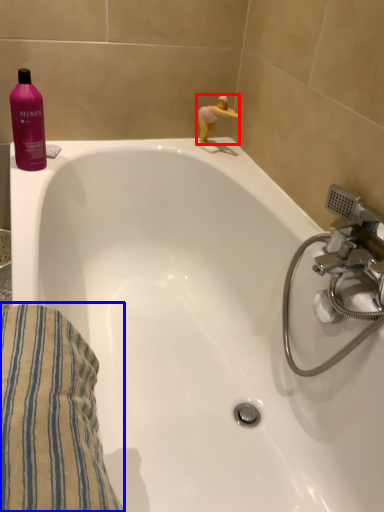
Question: Which of the following is the closest to the observer, miniature (highlighted by a red box) or bath towel (highlighted by a blue box)?

Choices:
 (A) miniature
 (B) bath towel

Answer: (B)